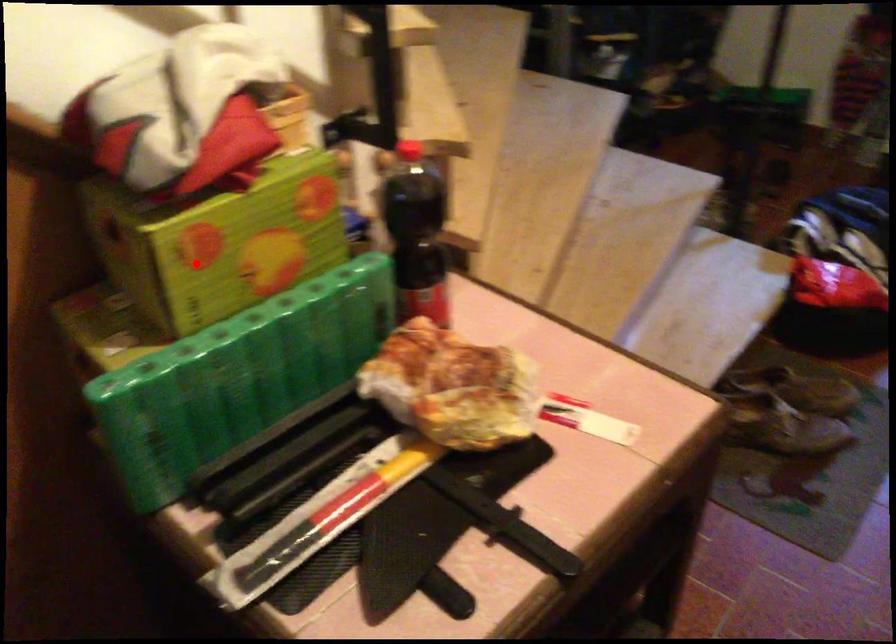
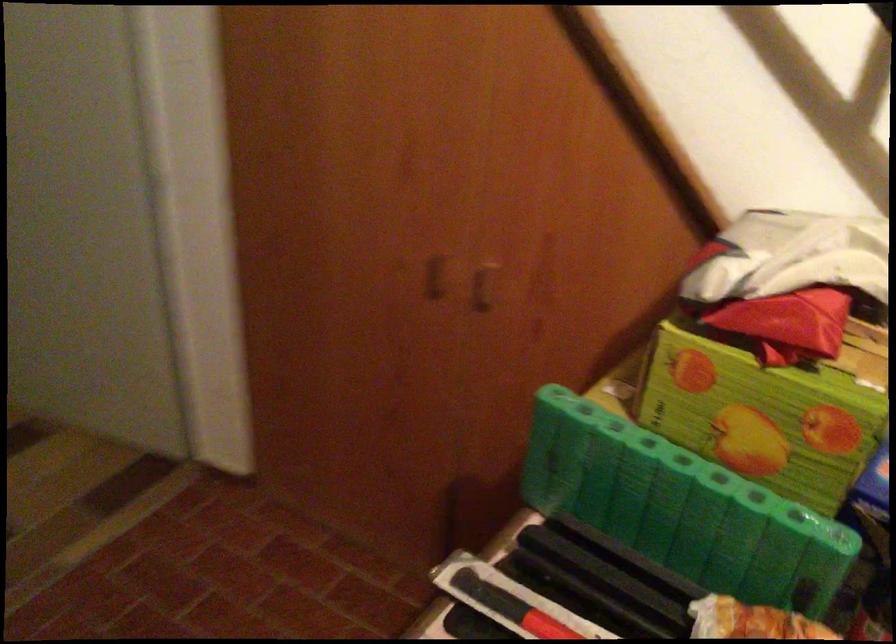
Where in the second image is the point corresponding to the highlighted location from the first image?

(686, 377)